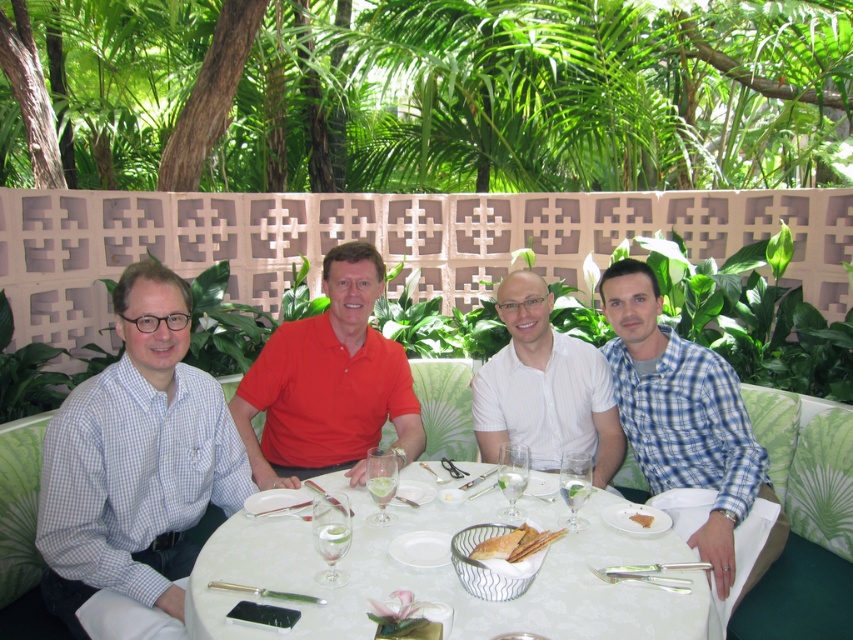
Question: Which of the following is the farthest from the observer?

Choices:
 (A) white glossy table at center
 (B) golden brown bread at center
 (C) blue plaid shirt at right

Answer: (C)

Question: Is blue checkered shirt at left to the left of white cracker at center from the viewer's perspective?

Choices:
 (A) no
 (B) yes

Answer: (B)

Question: Is blue checkered shirt at left closer to camera compared to white glossy table at center?

Choices:
 (A) yes
 (B) no

Answer: (B)

Question: Does white glossy table at center appear on the left side of white cracker at center?

Choices:
 (A) yes
 (B) no

Answer: (A)

Question: Which object is positioned closest to the golden brown bread at center?

Choices:
 (A) blue plaid shirt at right
 (B) white cracker at center

Answer: (B)

Question: Which object is closer to the camera taking this photo?

Choices:
 (A) golden brown bread at center
 (B) white cracker at center
 (C) blue checkered shirt at left
 (D) matte red polo shirt at center

Answer: (B)